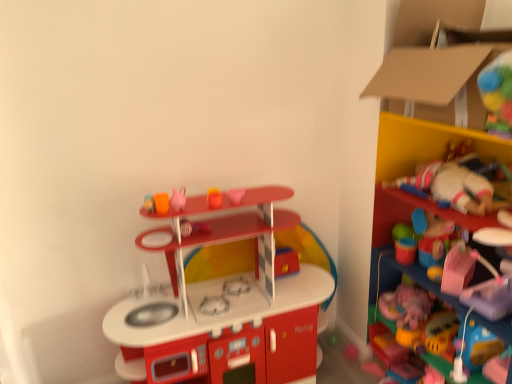
Question: Relative to matte plastic cup at center, which ranks as the 4th toy in top-to-bottom order, is matte plastic toy kitchen at center, the sixth toy in the top-to-bottom sequence, in front or behind?

Choices:
 (A) front
 (B) behind

Answer: (A)

Question: From the image's perspective, is matte plastic toy kitchen at center, the first toy from the bottom, positioned above or below matte plastic cup at center, which ranks as the 4th toy in top-to-bottom order?

Choices:
 (A) below
 (B) above

Answer: (A)

Question: Which of these objects is positioned farthest from the matte plastic cup at center, which ranks as the 4th toy in top-to-bottom order?

Choices:
 (A) plush fabric stuffed animal at right, which is the first shelf in top-to-bottom order
 (B) matte pink teapot at upper center, arranged as the 2th toy when viewed from the top
 (C) matte plastic toy kitchen at center, the sixth toy in the top-to-bottom sequence
 (D) rubberized plastic toys at right, the 2th shelf positioned from the top
 (E) cardboard at upper right

Answer: (E)

Question: Estimate the real-world distances between objects in this image. Which object is farther from the pink matte heart at upper center, which is the first toy in top-to-bottom order?

Choices:
 (A) matte pink teapot at upper center, arranged as the 2th toy when viewed from the top
 (B) rubberized plastic toys at right, which appears as the 1th shelf when ordered from the bottom
 (C) matte plastic toy kitchen at center, the first toy from the bottom
 (D) shiny plastic toy at center, acting as the 5th toy starting from the top
 (E) cardboard at upper right

Answer: (E)